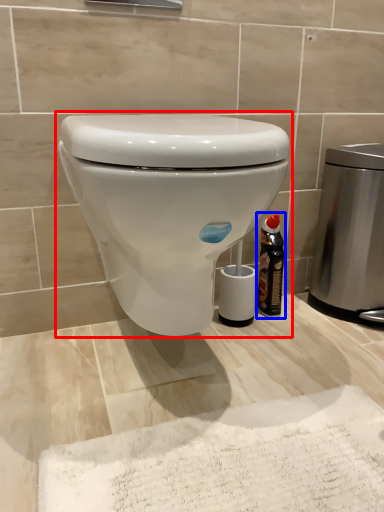
Question: Which point is further to the camera, toilet (highlighted by a red box) or bottle (highlighted by a blue box)?

Choices:
 (A) toilet
 (B) bottle

Answer: (B)